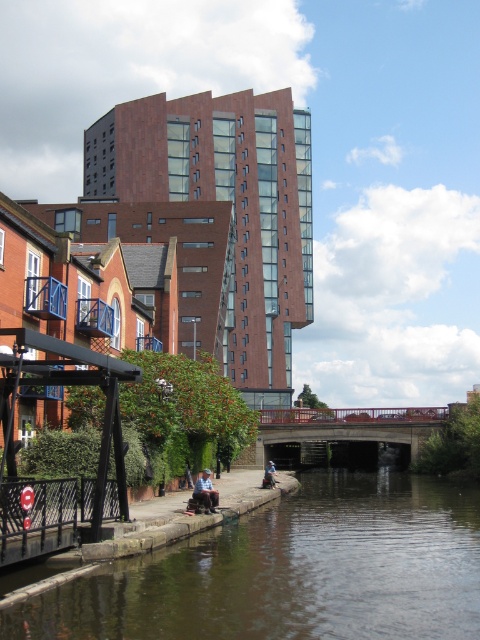
Question: Which object appears farthest from the camera in this image?

Choices:
 (A) brown stone river at lower center
 (B) denim jacket at lower center

Answer: (B)

Question: Which point appears farthest from the camera in this image?

Choices:
 (A) (205, 472)
 (B) (434, 532)
 (C) (274, 476)

Answer: (C)

Question: Is blue denim jeans at lower center below denim jacket at lower center?

Choices:
 (A) yes
 (B) no

Answer: (B)

Question: Estimate the real-world distances between objects in this image. Which object is closer to the denim jacket at lower center?

Choices:
 (A) blue denim jeans at lower center
 (B) brown stone river at lower center

Answer: (A)

Question: Does blue denim jeans at lower center appear over denim jacket at lower center?

Choices:
 (A) no
 (B) yes

Answer: (B)

Question: Does brown stone river at lower center have a smaller size compared to denim jacket at lower center?

Choices:
 (A) yes
 (B) no

Answer: (B)